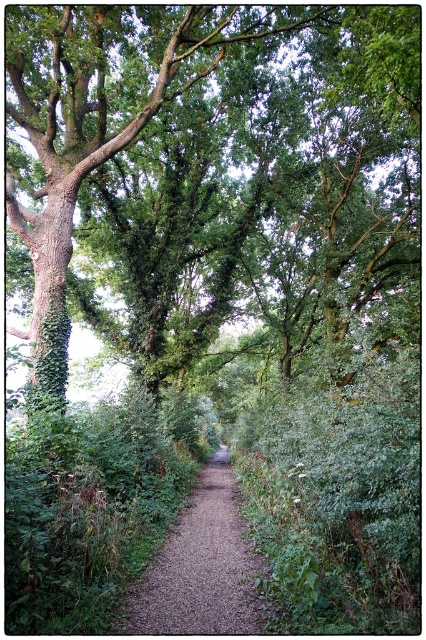
You are a hiker standing at the start of the path. You notice the green rough bark tree at upper center and the brown gravel path at center. Which object is positioned higher relative to the other?

The green rough bark tree at upper center is positioned above the brown gravel path at center.

You are a hiker walking along the brown gravel path at center. You want to take a photo of the green rough bark tree at upper center. Which direction should you face to capture the tree in your viewfinder without any obstructions?

The brown gravel path at center is behind green rough bark tree at upper center, so you should face away from the tree to ensure the path does not block your view.

You are a hiker navigating a narrow dirt path through a dense forest. You notice two points marked on your map corresponding to coordinates in the scene. The first point is at location point (417, 268) and the second is at point (250, 627). Which point is closer to you as you stand on the path?

Point (417, 268) is closer to you because it is further to the viewer than point (250, 627), meaning it lies nearer along your line of sight.